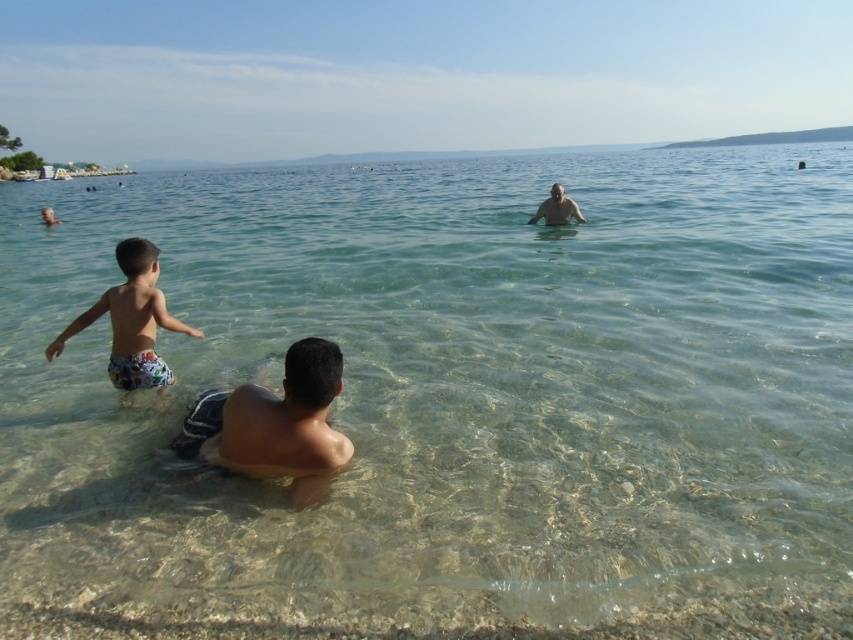
You are a photographer trying to capture a group photo of the printed swim trunks at left and the smooth skin man at upper center. Since you want to ensure both are fully visible in the frame, which one should you adjust your camera angle to focus on first to avoid cropping?

The printed swim trunks at left has a greater height compared to the smooth skin man at upper center, so you should focus on the printed swim trunks at left first to ensure it fits within the frame before adjusting for the smaller one.

You are a photographer trying to capture a group photo of the light brown skin at center and the printed swim trunks at left. Based on their positions, which subject should you focus on first if you want to ensure both are in focus?

You should focus on the printed swim trunks at left first because it is taller than light brown skin at center, so focusing on the taller subject will help ensure both are in focus.